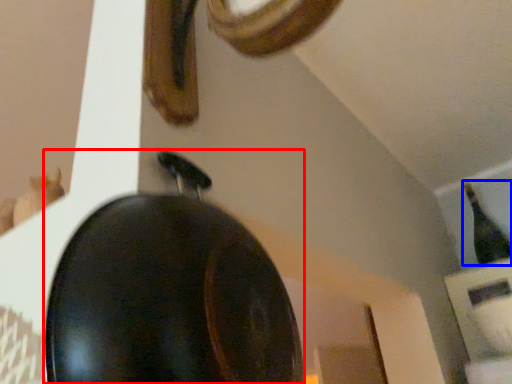
Question: Among these objects, which one is nearest to the camera, frying pan (highlighted by a red box) or bottle (highlighted by a blue box)?

Choices:
 (A) frying pan
 (B) bottle

Answer: (A)